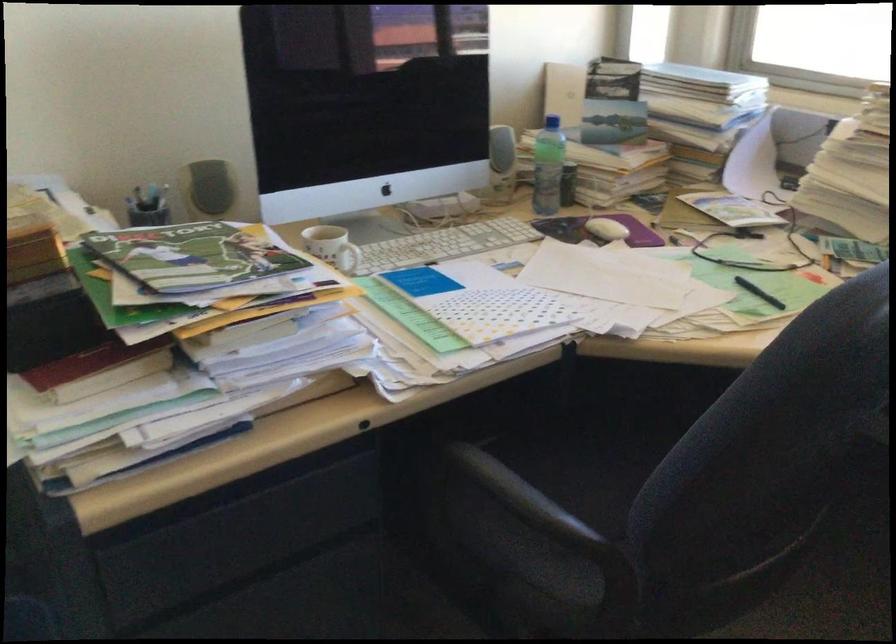
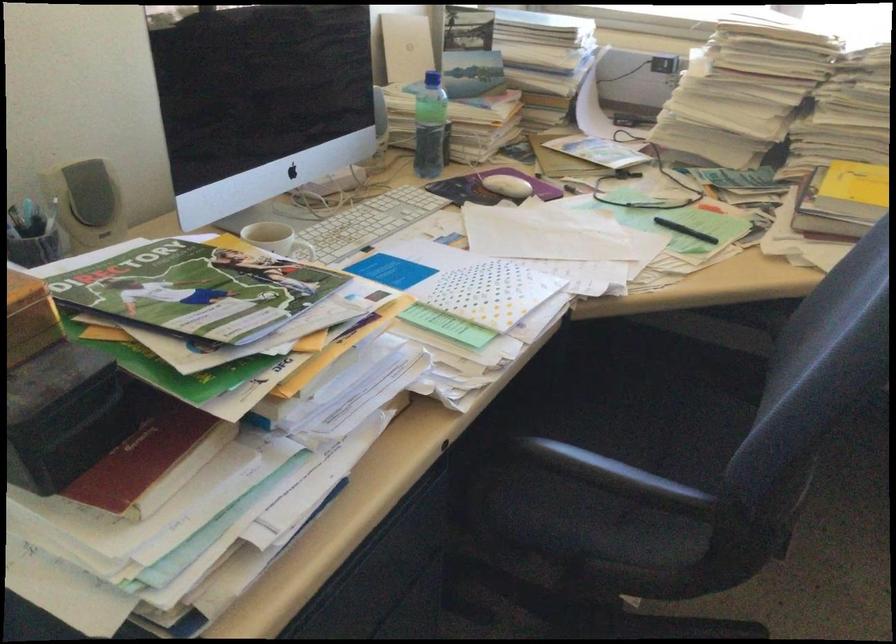
Where in the second image is the point corresponding to pixel 191 257 from the first image?

(195, 290)